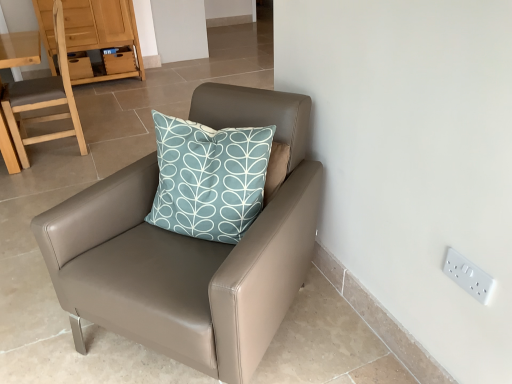
Question: Can you confirm if light brown wooden chair at left, which is counted as the first chair, starting from the back, is thinner than matte leather chair at center, the 1th chair from the front?

Choices:
 (A) no
 (B) yes

Answer: (B)

Question: Would you say matte leather chair at center, which appears as the second chair when viewed from the back, is part of light brown wooden chair at left, arranged as the 1th chair when viewed from the left,'s contents?

Choices:
 (A) yes
 (B) no

Answer: (B)

Question: Does light brown wooden chair at left, which ranks as the second chair in right-to-left order, have a greater height compared to matte leather chair at center, the 1th chair from the front?

Choices:
 (A) no
 (B) yes

Answer: (B)

Question: Is light brown wooden chair at left, which is counted as the first chair, starting from the back, in front of matte leather chair at center, the 1th chair positioned from the right?

Choices:
 (A) yes
 (B) no

Answer: (B)

Question: Does light brown wooden chair at left, which is counted as the first chair, starting from the back, turn towards matte leather chair at center, the 1th chair positioned from the right?

Choices:
 (A) no
 (B) yes

Answer: (A)

Question: Would you say white plastic electric outlet at upper right is inside or outside matte leather chair at center, the 1th chair from the front?

Choices:
 (A) outside
 (B) inside

Answer: (A)

Question: Considering the positions of point (480, 286) and point (190, 276), is point (480, 286) closer or farther from the camera than point (190, 276)?

Choices:
 (A) closer
 (B) farther

Answer: (A)

Question: From the image's perspective, is white plastic electric outlet at upper right located above or below matte leather chair at center, the 1th chair from the front?

Choices:
 (A) above
 (B) below

Answer: (B)

Question: Looking at the image, does white plastic electric outlet at upper right seem bigger or smaller compared to matte leather chair at center, the 1th chair from the front?

Choices:
 (A) small
 (B) big

Answer: (A)

Question: Is matte leather chair at center, the 1th chair from the front, taller or shorter than white plastic electric outlet at upper right?

Choices:
 (A) short
 (B) tall

Answer: (B)

Question: Considering their positions, is matte leather chair at center, the 1th chair positioned from the right, located in front of or behind white plastic electric outlet at upper right?

Choices:
 (A) front
 (B) behind

Answer: (A)

Question: From the image's perspective, relative to white plastic electric outlet at upper right, is matte leather chair at center, which is the 2th chair from left to right, above or below?

Choices:
 (A) below
 (B) above

Answer: (B)

Question: Considering the relative positions of matte leather chair at center, which appears as the second chair when viewed from the back, and white plastic electric outlet at upper right in the image provided, is matte leather chair at center, which appears as the second chair when viewed from the back, to the left or to the right of white plastic electric outlet at upper right?

Choices:
 (A) left
 (B) right

Answer: (A)

Question: From a real-world perspective, relative to light brown wooden chair at left, which is counted as the first chair, starting from the back, is white plastic electric outlet at upper right vertically above or below?

Choices:
 (A) below
 (B) above

Answer: (A)

Question: Choose the correct answer: Is white plastic electric outlet at upper right inside light brown wooden chair at left, which is counted as the first chair, starting from the back, or outside it?

Choices:
 (A) inside
 (B) outside

Answer: (B)